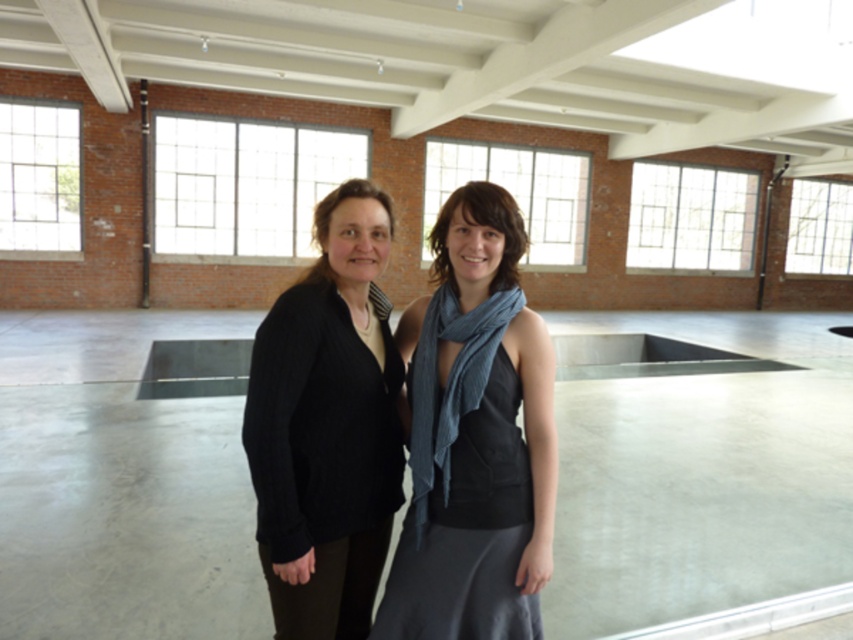
Is point (341, 589) farther from camera compared to point (440, 428)?

Yes, it is behind point (440, 428).

Is black knit sweater at center wider than blue textured scarf at center?

Yes, black knit sweater at center is wider than blue textured scarf at center.

Does point (334, 589) come in front of point (427, 380)?

No, it is not.

This screenshot has width=853, height=640. Find the location of `black knit sweater at center`. black knit sweater at center is located at coordinates (328, 426).

Is point (399, 624) positioned in front of point (323, 243)?

Yes, it is in front of point (323, 243).

Which is behind, point (495, 396) or point (287, 365)?

The point (495, 396) is behind.

Describe the element at coordinates (474, 436) in the screenshot. The image size is (853, 640). I see `dark gray fabric dress at center` at that location.

Identify the location of dark gray fabric dress at center. This screenshot has width=853, height=640. (474, 436).

Between dark gray fabric dress at center and blue textured scarf at center, which one has less height?

With less height is blue textured scarf at center.

Does point (439, 589) lie in front of point (436, 328)?

Yes.

At what (x,y) coordinates should I click in order to perform the action: click on dark gray fabric dress at center. Please return your answer as a coordinate pair (x, y). The width and height of the screenshot is (853, 640). Looking at the image, I should click on (474, 436).